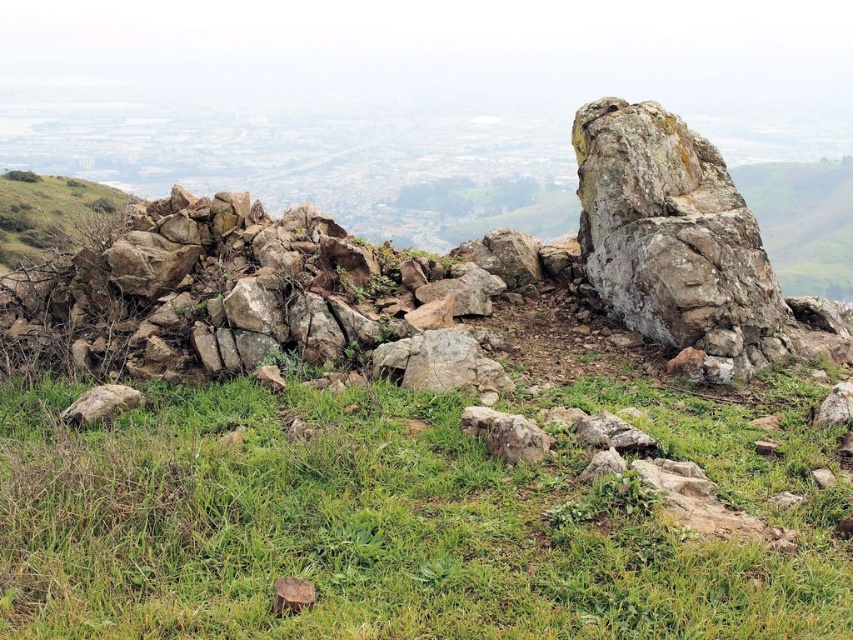
You are standing at the point marked by the coordinate point (x=393, y=522) in the image. What type of terrain are you currently standing on?

The point (x=393, y=522) marks green grassy at lower center, so you are standing on green grassy terrain.